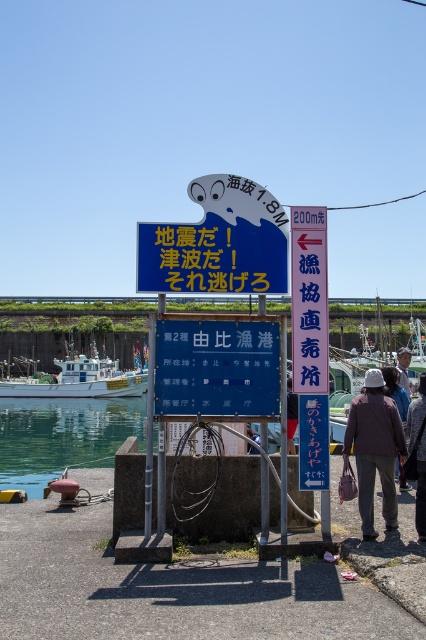
You are a traveler who just arrived at the Yubi Fishing Port and is looking for a place to store your jackets. You have two jackets with you, the brown matte jacket at center and the brown fabric jacket at lower right. Which jacket is taller and would require more vertical storage space?

The brown matte jacket at center is taller than the brown fabric jacket at lower right, so it would require more vertical storage space.

In the scene shown: You are a photographer planning to take a wide shot of the harbor scene. You want to ensure that both the clear water at lower left and the white glossy boat at left are fully visible in the frame. Based on their sizes, which object should you prioritize positioning closer to the camera to ensure it doesn t get cropped out?

The clear water at lower left is larger in size than the white glossy boat at left. To ensure both are fully visible, prioritize positioning the white glossy boat at left closer to the camera since it is smaller and might be more prone to cropping if placed further away.